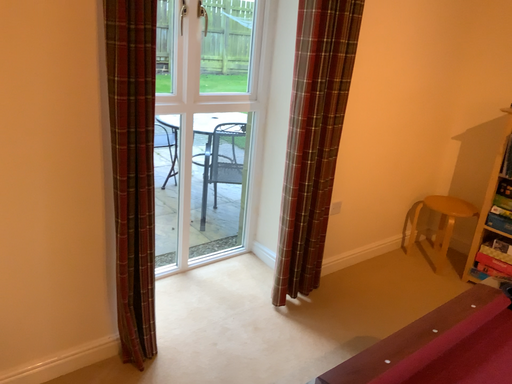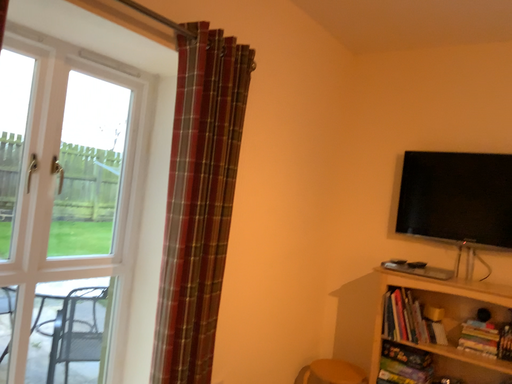
Question: Which way did the camera rotate in the video?

Choices:
 (A) rotated upward
 (B) rotated downward

Answer: (A)